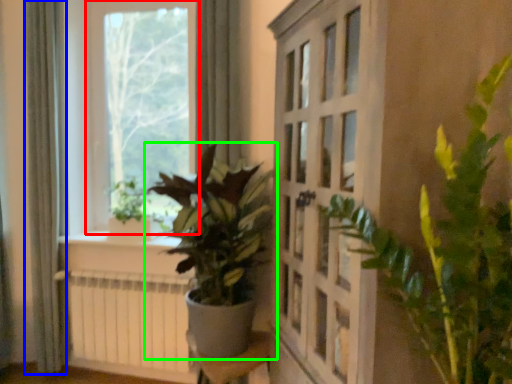
Question: Based on their relative distances, which object is nearer to window (highlighted by a red box)? Choose from curtain (highlighted by a blue box) and houseplant (highlighted by a green box).

Choices:
 (A) curtain
 (B) houseplant

Answer: (A)